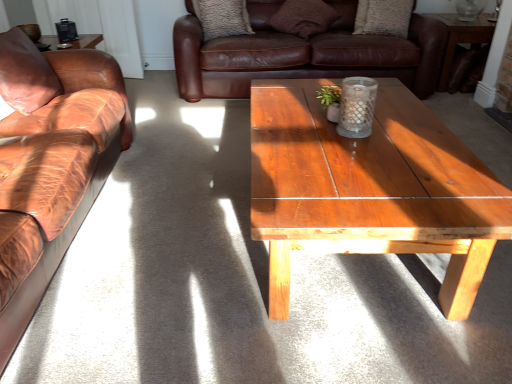
Question: From the image's perspective, is textured brown pillow at upper center, the third pillow positioned from the right, beneath brown leather couch at left, the second studio couch in the top-to-bottom sequence?

Choices:
 (A) no
 (B) yes

Answer: (A)

Question: Can we say textured brown pillow at upper center, the second pillow when ordered from back to front, lies outside brown leather couch at left, the first studio couch from the left?

Choices:
 (A) no
 (B) yes

Answer: (B)

Question: Is textured brown pillow at upper center, which ranks as the 2th pillow in left-to-right order, bigger than brown leather couch at left, the second studio couch in the top-to-bottom sequence?

Choices:
 (A) no
 (B) yes

Answer: (A)

Question: Considering the relative positions of textured brown pillow at upper center, positioned as the 3th pillow in front-to-back order, and brown leather couch at left, acting as the first studio couch starting from the front, in the image provided, is textured brown pillow at upper center, positioned as the 3th pillow in front-to-back order, to the right of brown leather couch at left, acting as the first studio couch starting from the front, from the viewer's perspective?

Choices:
 (A) yes
 (B) no

Answer: (A)

Question: Can you confirm if textured brown pillow at upper center, positioned as the 3th pillow in front-to-back order, is wider than brown leather couch at left, the first studio couch from the left?

Choices:
 (A) yes
 (B) no

Answer: (B)

Question: Visually, is transparent glass vase at upper right positioned to the left or to the right of textured beige pillow at upper center, which appears as the 1th pillow when viewed from the back?

Choices:
 (A) left
 (B) right

Answer: (B)

Question: Looking at their shapes, would you say transparent glass vase at upper right is wider or thinner than textured beige pillow at upper center, the first pillow viewed from the right?

Choices:
 (A) wide
 (B) thin

Answer: (A)

Question: Based on their sizes in the image, would you say transparent glass vase at upper right is bigger or smaller than textured beige pillow at upper center, acting as the fourth pillow starting from the left?

Choices:
 (A) big
 (B) small

Answer: (B)

Question: Is transparent glass vase at upper right inside the boundaries of textured beige pillow at upper center, acting as the fourth pillow starting from the left, or outside?

Choices:
 (A) inside
 (B) outside

Answer: (B)

Question: Is brown leather couch at left, the second studio couch in the top-to-bottom sequence, to the left or to the right of transparent glass vase at upper right in the image?

Choices:
 (A) left
 (B) right

Answer: (A)

Question: Considering the positions of brown leather couch at left, which ranks as the second studio couch in back-to-front order, and transparent glass vase at upper right in the image, is brown leather couch at left, which ranks as the second studio couch in back-to-front order, bigger or smaller than transparent glass vase at upper right?

Choices:
 (A) small
 (B) big

Answer: (B)

Question: Considering the positions of brown leather couch at left, acting as the first studio couch starting from the front, and transparent glass vase at upper right in the image, is brown leather couch at left, acting as the first studio couch starting from the front, wider or thinner than transparent glass vase at upper right?

Choices:
 (A) thin
 (B) wide

Answer: (B)

Question: From a real-world perspective, is brown leather couch at left, the second studio couch in the top-to-bottom sequence, positioned above or below transparent glass vase at upper right?

Choices:
 (A) above
 (B) below

Answer: (B)

Question: Is textured brown pillow at upper center, positioned as the 3th pillow in front-to-back order, wider or thinner than wooden table at upper right?

Choices:
 (A) wide
 (B) thin

Answer: (B)

Question: Considering the positions of point (224, 14) and point (452, 26), is point (224, 14) closer or farther from the camera than point (452, 26)?

Choices:
 (A) farther
 (B) closer

Answer: (A)